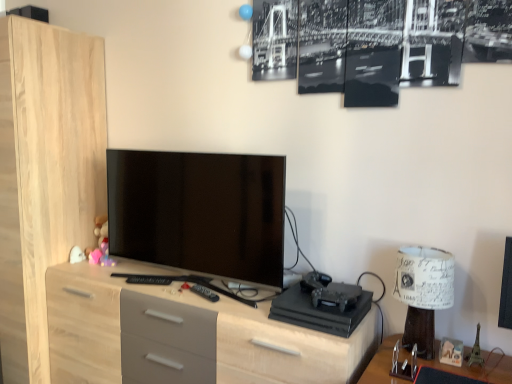
Question: Does light wood/grey drawers at center have a lesser width compared to white paper lampshade at right?

Choices:
 (A) no
 (B) yes

Answer: (A)

Question: Is light wood/grey drawers at center taller than white paper lampshade at right?

Choices:
 (A) no
 (B) yes

Answer: (B)

Question: Is light wood/grey drawers at center at the left side of white paper lampshade at right?

Choices:
 (A) no
 (B) yes

Answer: (B)

Question: Can you confirm if light wood/grey drawers at center is smaller than white paper lampshade at right?

Choices:
 (A) yes
 (B) no

Answer: (B)

Question: Is light wood/grey drawers at center aimed at white paper lampshade at right?

Choices:
 (A) no
 (B) yes

Answer: (A)

Question: Considering their positions, is matte black tv at center located in front of or behind white paper lampshade at right?

Choices:
 (A) behind
 (B) front

Answer: (A)

Question: Considering the positions of point (225, 215) and point (426, 354), is point (225, 215) closer or farther from the camera than point (426, 354)?

Choices:
 (A) farther
 (B) closer

Answer: (A)

Question: Looking at their shapes, would you say matte black tv at center is wider or thinner than white paper lampshade at right?

Choices:
 (A) thin
 (B) wide

Answer: (A)

Question: From a real-world perspective, is matte black tv at center physically located above or below white paper lampshade at right?

Choices:
 (A) above
 (B) below

Answer: (A)

Question: From a real-world perspective, is white paper lampshade at right above or below light wood/grey drawers at center?

Choices:
 (A) below
 (B) above

Answer: (B)

Question: In terms of height, does white paper lampshade at right look taller or shorter compared to light wood/grey drawers at center?

Choices:
 (A) short
 (B) tall

Answer: (A)

Question: In the image, is white paper lampshade at right on the left side or the right side of light wood/grey drawers at center?

Choices:
 (A) right
 (B) left

Answer: (A)

Question: Considering the positions of white paper lampshade at right and light wood/grey drawers at center in the image, is white paper lampshade at right bigger or smaller than light wood/grey drawers at center?

Choices:
 (A) small
 (B) big

Answer: (A)

Question: From the image's perspective, is light wood/grey drawers at center positioned above or below white paper lampshade at right?

Choices:
 (A) above
 (B) below

Answer: (B)

Question: From their relative heights in the image, would you say light wood/grey drawers at center is taller or shorter than white paper lampshade at right?

Choices:
 (A) tall
 (B) short

Answer: (A)